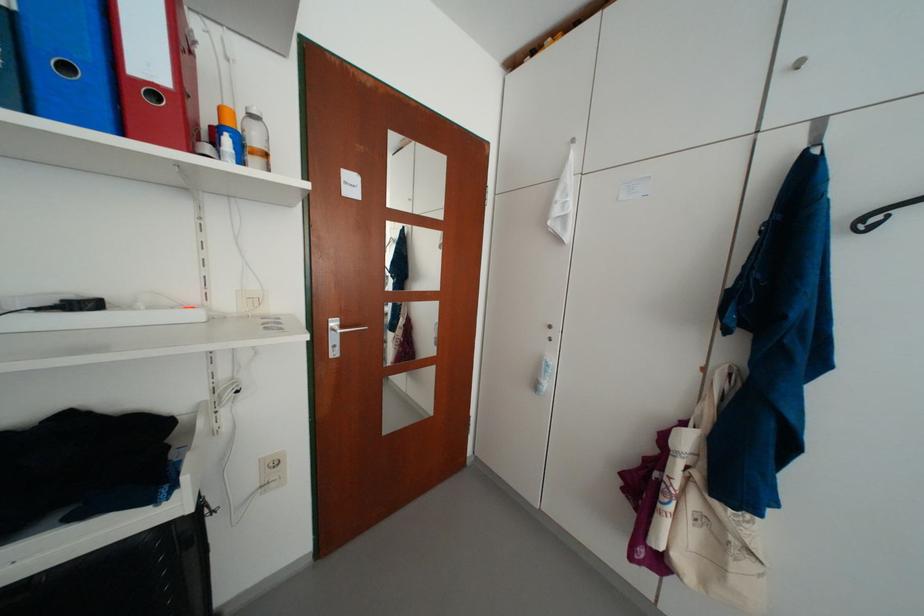
This screenshot has width=924, height=616. I want to click on blue bottle pump, so click(227, 136).